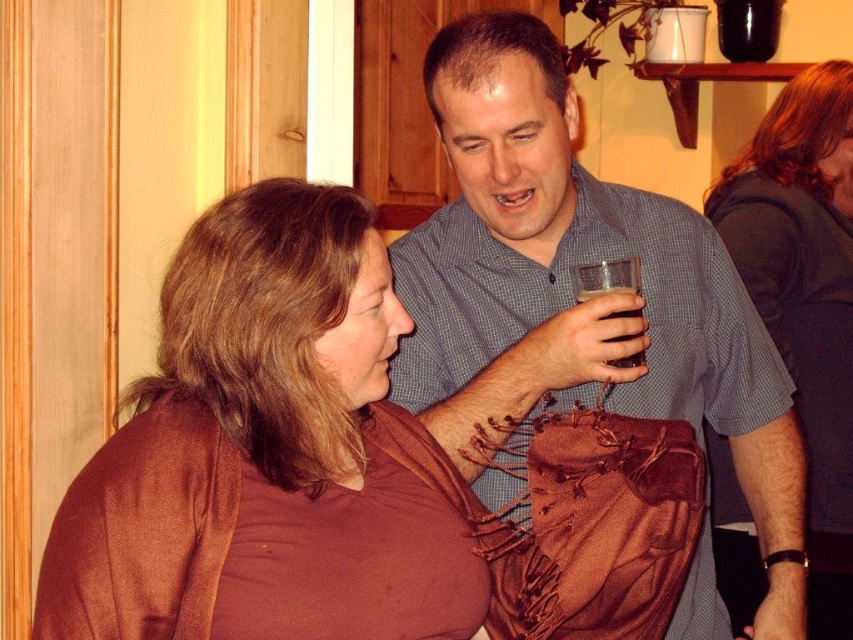
Is point (235, 556) more distant than point (473, 276)?

That is False.

Which is behind, point (323, 243) or point (511, 292)?

Positioned behind is point (511, 292).

Which is behind, point (352, 324) or point (500, 244)?

The point (500, 244) is behind.

Identify the location of brown fabric scarf at center. This screenshot has width=853, height=640. (262, 452).

Find the location of `blue checkered shirt at center`. blue checkered shirt at center is located at coordinates (570, 278).

Which of these two, blue checkered shirt at center or clear glass at upper right, stands taller?

Standing taller between the two is blue checkered shirt at center.

Describe the element at coordinates (570, 278) in the screenshot. I see `blue checkered shirt at center` at that location.

Where is `blue checkered shirt at center`? This screenshot has height=640, width=853. blue checkered shirt at center is located at coordinates (570, 278).

Who is higher up, brown fabric scarf at center or dark gray fabric at upper right?

dark gray fabric at upper right is higher up.

Can you confirm if brown fabric scarf at center is positioned above dark gray fabric at upper right?

Incorrect, brown fabric scarf at center is not positioned above dark gray fabric at upper right.

Who is more forward, (194, 614) or (717, 444)?

Point (194, 614) is more forward.

Locate an element on the screen. brown fabric scarf at center is located at coordinates (262, 452).